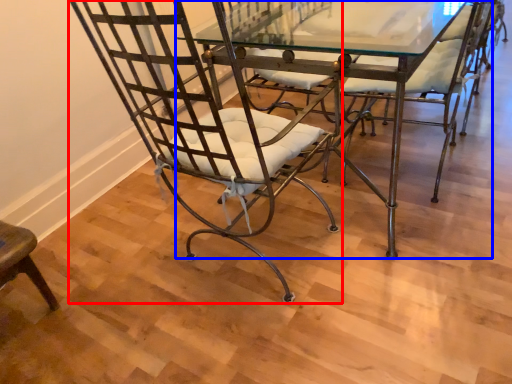
Question: Which object appears farthest to the camera in this image, chair (highlighted by a red box) or table (highlighted by a blue box)?

Choices:
 (A) chair
 (B) table

Answer: (B)